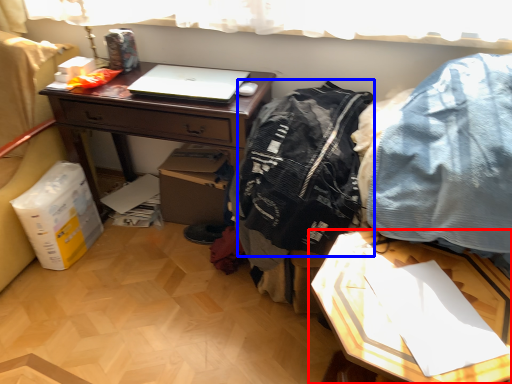
Question: Which object appears closest to the camera in this image, table (highlighted by a red box) or clothing (highlighted by a blue box)?

Choices:
 (A) table
 (B) clothing

Answer: (A)